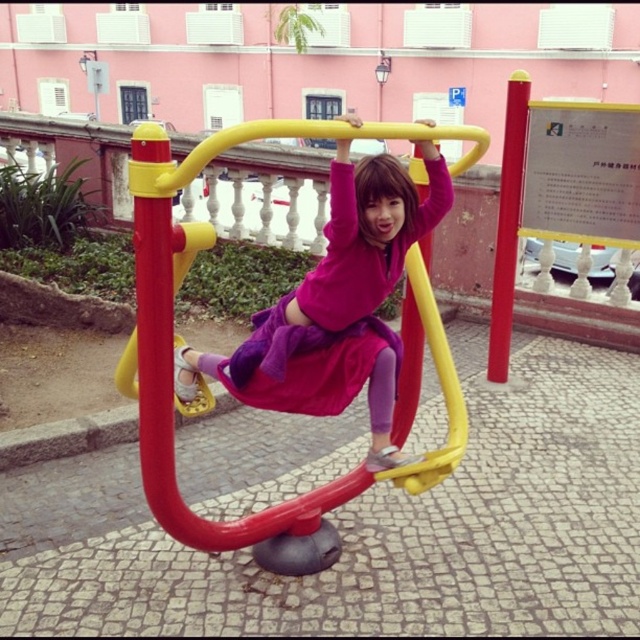
Question: Does purple velvet dress at center have a lesser width compared to yellow plastic pole at center?

Choices:
 (A) no
 (B) yes

Answer: (A)

Question: Which of the following is the closest to the observer?

Choices:
 (A) red plastic pole at center
 (B) matte plastic swing at center

Answer: (B)

Question: Can you confirm if matte plastic swing at center is thinner than purple velvet dress at center?

Choices:
 (A) no
 (B) yes

Answer: (A)

Question: Which of the following is the closest to the observer?

Choices:
 (A) yellow plastic pole at center
 (B) matte plastic swing at center
 (C) red plastic pole at center
 (D) purple velvet dress at center

Answer: (B)

Question: Based on their relative distances, which object is nearer to the yellow plastic pole at center?

Choices:
 (A) purple velvet dress at center
 (B) matte plastic swing at center
 (C) red plastic pole at center

Answer: (A)

Question: Is purple velvet dress at center smaller than yellow plastic pole at center?

Choices:
 (A) no
 (B) yes

Answer: (A)